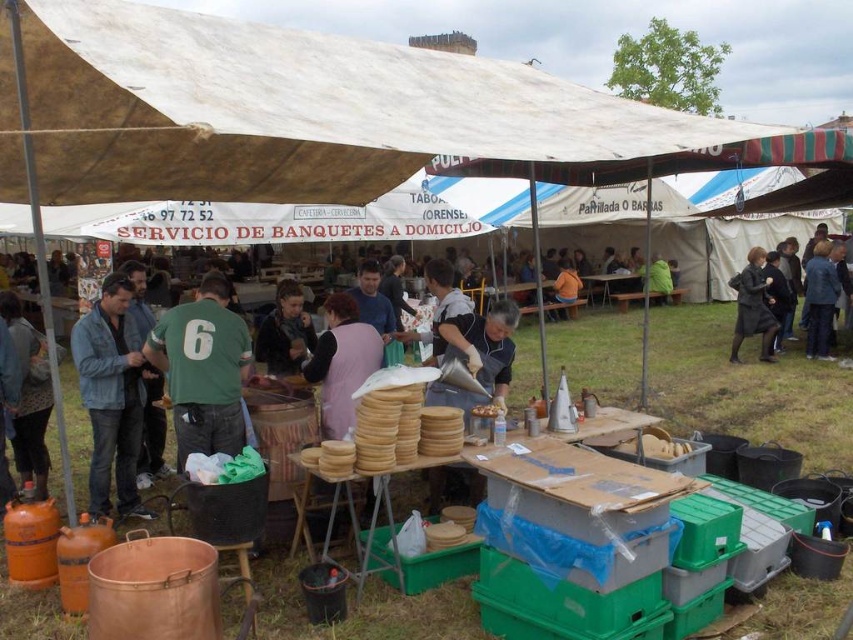
Which is more to the left, green fabric shirt at center or dark brown leather jacket at center?

green fabric shirt at center is more to the left.

Which of these two, green fabric shirt at center or dark brown leather jacket at center, stands taller?

green fabric shirt at center

Who is more forward, (x=222, y=436) or (x=285, y=342)?

Point (x=222, y=436) is more forward.

I want to click on green fabric shirt at center, so click(202, 369).

How far apart are green fabric shirt at center and blue fabric jacket at upper right?

green fabric shirt at center and blue fabric jacket at upper right are 9.32 meters apart from each other.

Can you confirm if green fabric shirt at center is positioned to the left of blue fabric jacket at upper right?

Indeed, green fabric shirt at center is positioned on the left side of blue fabric jacket at upper right.

This screenshot has height=640, width=853. Identify the location of green fabric shirt at center. (202, 369).

Which is below, denim jacket at left or orange fabric shirt at center?

denim jacket at left

Who is more distant from viewer, (97, 451) or (576, 285)?

Point (576, 285)

Find the location of `denim jacket at left`. denim jacket at left is located at coordinates (111, 396).